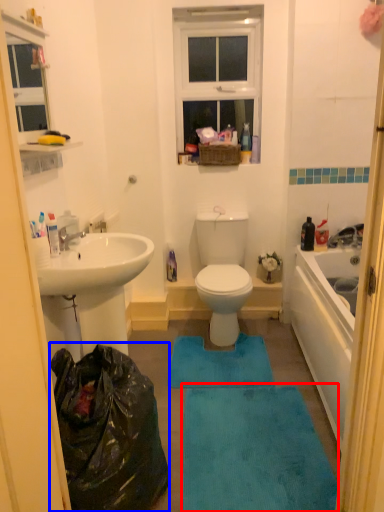
Question: Which of the following is the farthest to the observer, bath mat (highlighted by a red box) or garbage (highlighted by a blue box)?

Choices:
 (A) bath mat
 (B) garbage

Answer: (A)